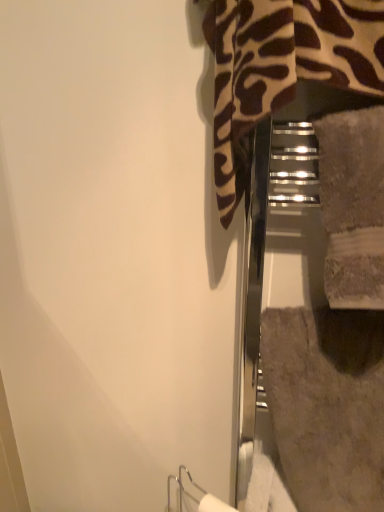
Question: Is beige textured towel at center inside gray textured bath towel at right?

Choices:
 (A) no
 (B) yes

Answer: (A)

Question: Is gray textured bath towel at right bigger than beige textured towel at center?

Choices:
 (A) no
 (B) yes

Answer: (B)

Question: Considering the relative sizes of gray textured bath towel at right and beige textured towel at center in the image provided, is gray textured bath towel at right smaller than beige textured towel at center?

Choices:
 (A) yes
 (B) no

Answer: (B)

Question: From a real-world perspective, is gray textured bath towel at right physically above beige textured towel at center?

Choices:
 (A) no
 (B) yes

Answer: (A)

Question: Can you confirm if gray textured bath towel at right is positioned to the left of beige textured towel at center?

Choices:
 (A) yes
 (B) no

Answer: (B)

Question: Can we say gray textured bath towel at right lies outside beige textured towel at center?

Choices:
 (A) no
 (B) yes

Answer: (B)

Question: Are beige textured towel at center and gray textured bath towel at right making contact?

Choices:
 (A) yes
 (B) no

Answer: (B)

Question: Is the position of beige textured towel at center less distant than that of gray textured bath towel at right?

Choices:
 (A) yes
 (B) no

Answer: (A)

Question: Does beige textured towel at center have a greater height compared to gray textured bath towel at right?

Choices:
 (A) yes
 (B) no

Answer: (B)

Question: From the image's perspective, is beige textured towel at center located above gray textured bath towel at right?

Choices:
 (A) no
 (B) yes

Answer: (B)

Question: Considering the relative positions of beige textured towel at center and gray textured bath towel at right in the image provided, is beige textured towel at center to the right of gray textured bath towel at right from the viewer's perspective?

Choices:
 (A) yes
 (B) no

Answer: (B)

Question: From a real-world perspective, is beige textured towel at center physically above gray textured bath towel at right?

Choices:
 (A) no
 (B) yes

Answer: (B)

Question: From the image's perspective, relative to beige textured towel at center, is gray textured bath towel at right above or below?

Choices:
 (A) below
 (B) above

Answer: (A)